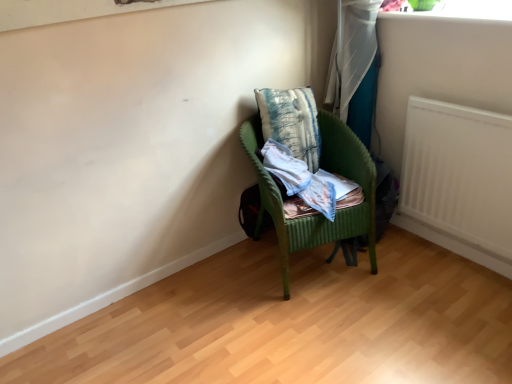
This screenshot has height=384, width=512. In order to click on empty space that is to the right of green wicker chair at center in this screenshot , I will do `click(421, 268)`.